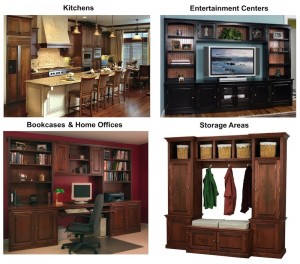
At what (x,y) coordinates should I click in order to perform the action: click on kitchen floor. Please return your answer as a coordinate pair (x, y). Looking at the image, I should click on (128, 110).